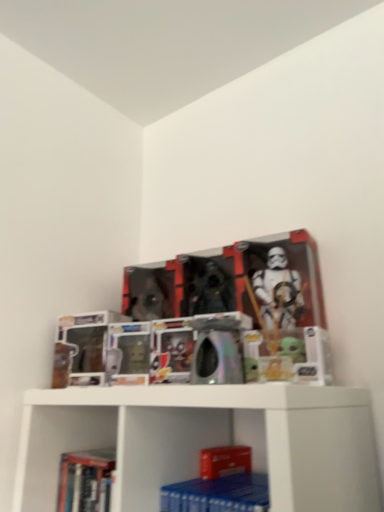
Question: Should I look upward or downward to see hardcover book at lower left?

Choices:
 (A) down
 (B) up

Answer: (A)

Question: Is blue matte paperback book at lower center at the right side of hardcover book at lower left?

Choices:
 (A) yes
 (B) no

Answer: (A)

Question: Considering the relative sizes of blue matte paperback book at lower center and hardcover book at lower left in the image provided, is blue matte paperback book at lower center thinner than hardcover book at lower left?

Choices:
 (A) yes
 (B) no

Answer: (B)

Question: Does blue matte paperback book at lower center come in front of hardcover book at lower left?

Choices:
 (A) yes
 (B) no

Answer: (A)

Question: Can you confirm if blue matte paperback book at lower center is wider than hardcover book at lower left?

Choices:
 (A) no
 (B) yes

Answer: (B)

Question: Could you tell me if blue matte paperback book at lower center is facing hardcover book at lower left?

Choices:
 (A) no
 (B) yes

Answer: (A)

Question: Is blue matte paperback book at lower center oriented away from hardcover book at lower left?

Choices:
 (A) no
 (B) yes

Answer: (A)

Question: Does hardcover book at lower left have a smaller size compared to blue matte paperback book at lower center?

Choices:
 (A) no
 (B) yes

Answer: (A)

Question: Can you confirm if hardcover book at lower left is positioned to the right of blue matte paperback book at lower center?

Choices:
 (A) yes
 (B) no

Answer: (B)

Question: Does hardcover book at lower left turn towards blue matte paperback book at lower center?

Choices:
 (A) yes
 (B) no

Answer: (B)

Question: From the image's perspective, is hardcover book at lower left under blue matte paperback book at lower center?

Choices:
 (A) yes
 (B) no

Answer: (A)

Question: Is hardcover book at lower left looking in the opposite direction of blue matte paperback book at lower center?

Choices:
 (A) no
 (B) yes

Answer: (A)

Question: From a real-world perspective, is hardcover book at lower left below blue matte paperback book at lower center?

Choices:
 (A) no
 (B) yes

Answer: (A)

Question: Looking at the image, does blue matte paperback book at lower center seem bigger or smaller compared to hardcover book at lower left?

Choices:
 (A) small
 (B) big

Answer: (A)